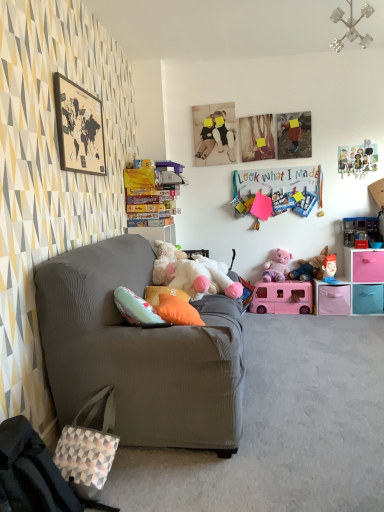
Question: Is orange fabric pillow at center next to metallic plastic toy at upper right, arranged as the sixth toy when viewed from the left, and touching it?

Choices:
 (A) no
 (B) yes

Answer: (A)

Question: Can you confirm if orange fabric pillow at center is bigger than metallic plastic toy at upper right, arranged as the sixth toy when viewed from the left?

Choices:
 (A) no
 (B) yes

Answer: (B)

Question: Is orange fabric pillow at center not near metallic plastic toy at upper right, marked as the 1th toy in a right-to-left arrangement?

Choices:
 (A) no
 (B) yes

Answer: (B)

Question: Can you confirm if orange fabric pillow at center is positioned to the right of metallic plastic toy at upper right, marked as the 1th toy in a right-to-left arrangement?

Choices:
 (A) yes
 (B) no

Answer: (B)

Question: From a real-world perspective, is orange fabric pillow at center located higher than metallic plastic toy at upper right, marked as the 1th toy in a right-to-left arrangement?

Choices:
 (A) yes
 (B) no

Answer: (B)

Question: Does point (215, 268) appear closer or farther from the camera than point (190, 317)?

Choices:
 (A) farther
 (B) closer

Answer: (A)

Question: Considering the positions of fluffy white teddy bear at center, marked as the 6th toy in a right-to-left arrangement, and orange fabric pillow at center in the image, is fluffy white teddy bear at center, marked as the 6th toy in a right-to-left arrangement, wider or thinner than orange fabric pillow at center?

Choices:
 (A) thin
 (B) wide

Answer: (B)

Question: In terms of size, does fluffy white teddy bear at center, marked as the 1th toy in a left-to-right arrangement, appear bigger or smaller than orange fabric pillow at center?

Choices:
 (A) small
 (B) big

Answer: (B)

Question: Do you think fluffy white teddy bear at center, marked as the 1th toy in a left-to-right arrangement, is within orange fabric pillow at center, or outside of it?

Choices:
 (A) outside
 (B) inside

Answer: (A)

Question: Is pink plastic van at center, the fourth toy positioned from the right, in front of or behind matte plastic toy at right, which is the 2th toy in right-to-left order, in the image?

Choices:
 (A) behind
 (B) front

Answer: (A)

Question: Is pink plastic van at center, positioned as the 3th toy in left-to-right order, inside the boundaries of matte plastic toy at right, the 5th toy from the left, or outside?

Choices:
 (A) inside
 (B) outside

Answer: (B)

Question: Is pink plastic van at center, positioned as the 3th toy in left-to-right order, taller or shorter than matte plastic toy at right, which is the 2th toy in right-to-left order?

Choices:
 (A) short
 (B) tall

Answer: (B)

Question: From a real-world perspective, relative to matte plastic toy at right, which is the 2th toy in right-to-left order, is pink plastic van at center, the fourth toy positioned from the right, vertically above or below?

Choices:
 (A) below
 (B) above

Answer: (A)

Question: Visually, is pink plastic van at center, the fourth toy positioned from the right, positioned to the left or to the right of metallic plastic toy at upper right, marked as the 1th toy in a right-to-left arrangement?

Choices:
 (A) left
 (B) right

Answer: (A)

Question: Considering the positions of pink plastic van at center, positioned as the 3th toy in left-to-right order, and metallic plastic toy at upper right, marked as the 1th toy in a right-to-left arrangement, in the image, is pink plastic van at center, positioned as the 3th toy in left-to-right order, taller or shorter than metallic plastic toy at upper right, marked as the 1th toy in a right-to-left arrangement,?

Choices:
 (A) short
 (B) tall

Answer: (B)